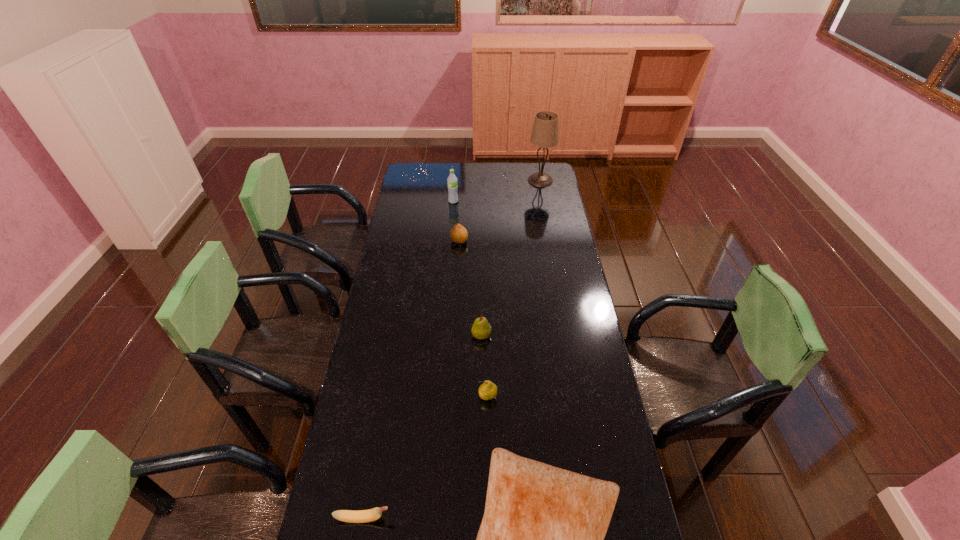
Find the location of a particular element. The height and width of the screenshot is (540, 960). vacant space located on the front-facing side of the tallest object is located at coordinates (460, 180).

You are a GUI agent. You are given a task and a screenshot of the screen. Output one action in this format:
    pyautogui.click(x=<x>, y=<y>)
    Task: Click on the vacant area located 0.230m on the front-facing side of the tallest object
    
    Given the screenshot: What is the action you would take?
    pyautogui.click(x=486, y=180)

I want to click on vacant space located on the front of the water bottle, so click(x=451, y=229).

Locate an element on the screen. free space located on the back of the leftmost pear is located at coordinates (462, 199).

You are a GUI agent. You are given a task and a screenshot of the screen. Output one action in this format:
    pyautogui.click(x=<x>, y=<y>)
    Task: Click on the free space located on the back of the second farthest pear
    This screenshot has height=540, width=960.
    Given the screenshot: What is the action you would take?
    pyautogui.click(x=481, y=278)

The height and width of the screenshot is (540, 960). I want to click on vacant area located on the back of the nearest pear, so click(486, 320).

This screenshot has height=540, width=960. I want to click on vacant region located at the stem of the leftmost object, so click(x=508, y=518).

This screenshot has height=540, width=960. I want to click on object that is at the far edge, so click(x=545, y=134).

You are a GUI agent. You are given a task and a screenshot of the screen. Output one action in this format:
    pyautogui.click(x=<x>, y=<y>)
    Task: Click on the object located at the left edge
    The height and width of the screenshot is (540, 960).
    Given the screenshot: What is the action you would take?
    pyautogui.click(x=362, y=516)

The height and width of the screenshot is (540, 960). What are the coordinates of `object at the right edge` in the screenshot? It's located at (545, 134).